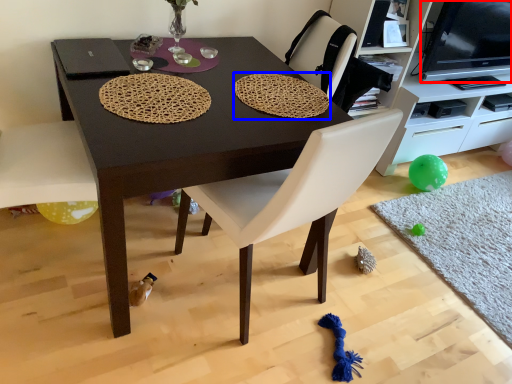
Question: Among these objects, which one is farthest to the camera, television (highlighted by a red box) or mat (highlighted by a blue box)?

Choices:
 (A) television
 (B) mat

Answer: (A)